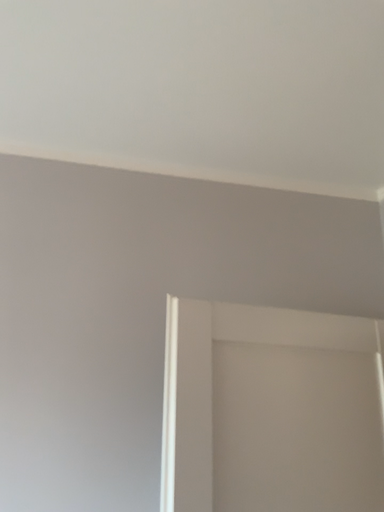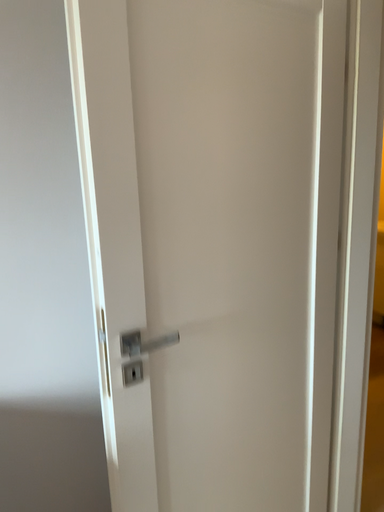
Question: How did the camera likely rotate when shooting the video?

Choices:
 (A) rotated downward
 (B) rotated upward

Answer: (A)